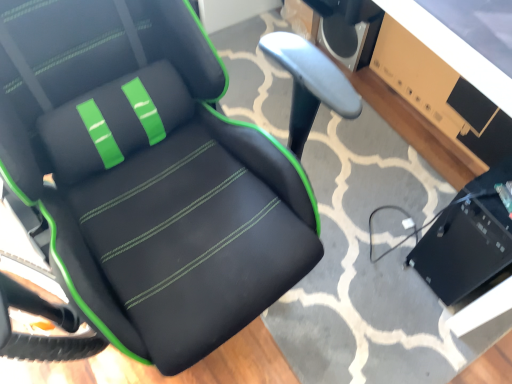
This screenshot has width=512, height=384. Identify the location of black leather chair at center. (153, 177).

This screenshot has height=384, width=512. Describe the element at coordinates (153, 177) in the screenshot. I see `black leather chair at center` at that location.

At what (x,y) coordinates should I click in order to perform the action: click on black leather chair at center. Please return your answer as a coordinate pair (x, y). Looking at the image, I should click on (153, 177).